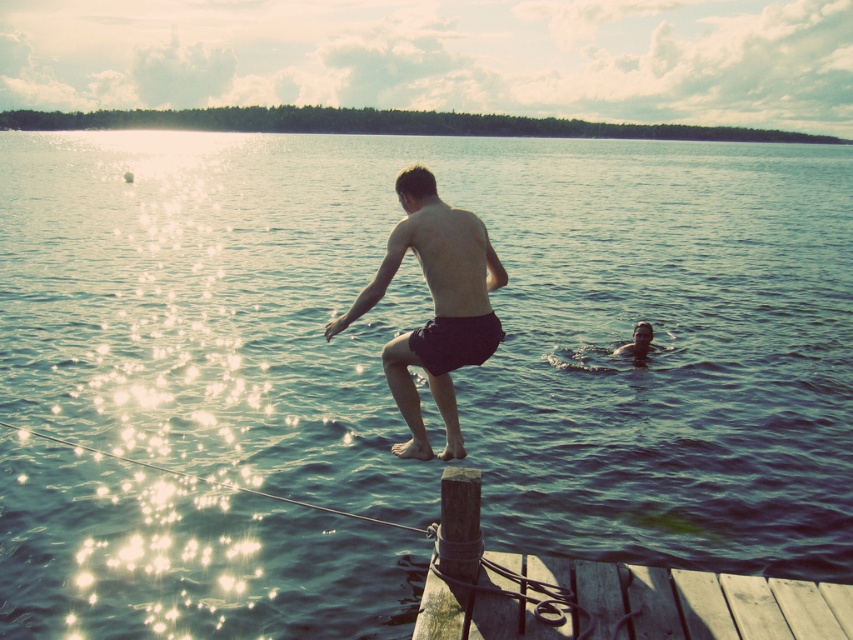
You are a photographer trying to capture the scene of the lakeside dock. You notice the black matte shorts at center and the smooth skin boy at lower right. Which object would appear larger in your photo?

The black matte shorts at center would appear larger in the photo since it is bigger than the smooth skin boy at lower right according to the description.